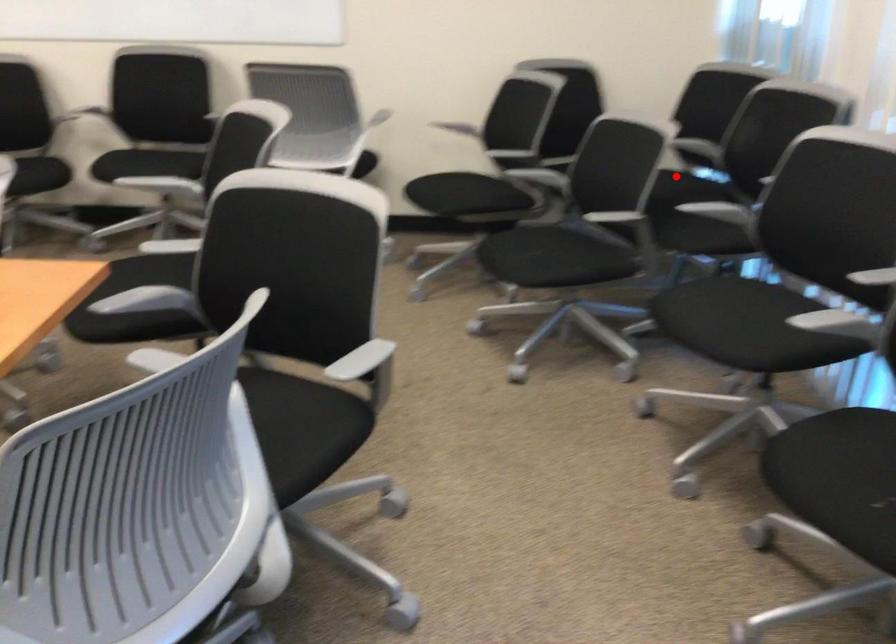
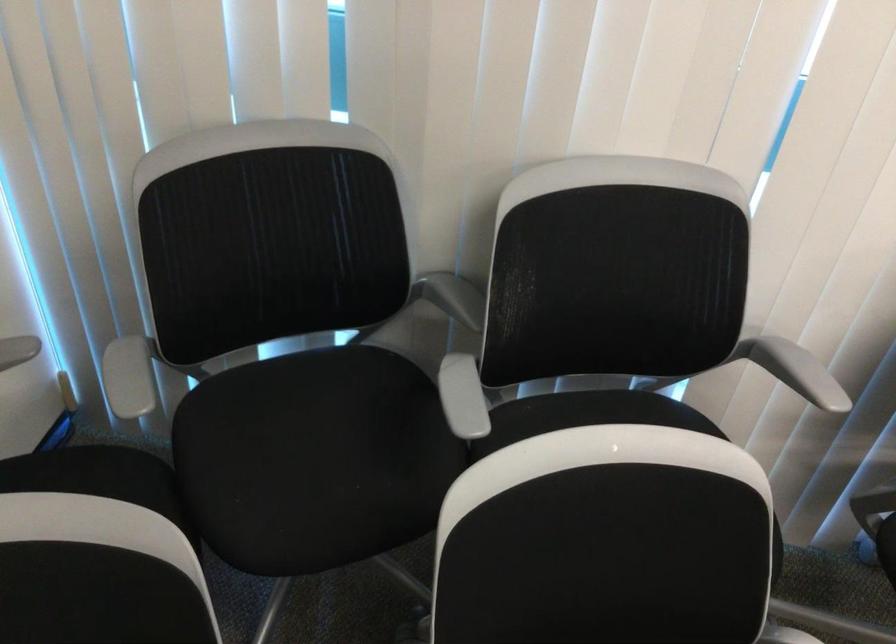
Locate, in the second image, the point that corresponds to the highlighted location in the first image.

(312, 442)